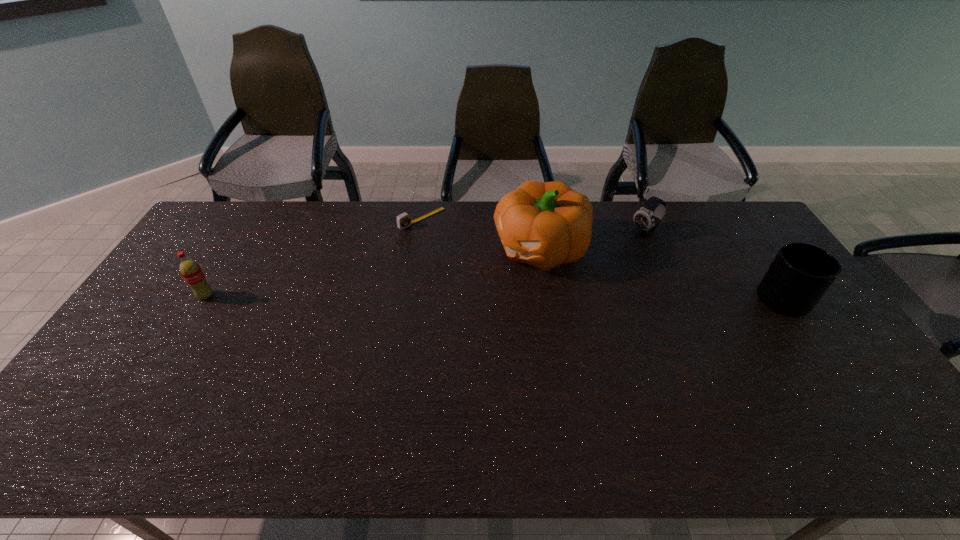
The width and height of the screenshot is (960, 540). I want to click on watch present at the far edge, so click(647, 219).

Locate an element on the screen. object that is at the left edge is located at coordinates (190, 270).

The image size is (960, 540). I want to click on object present at the right edge, so click(800, 274).

Image resolution: width=960 pixels, height=540 pixels. Find the location of `blank space at the far edge`. blank space at the far edge is located at coordinates (414, 204).

Find the location of a particular element. This screenshot has height=540, width=960. vacant space at the near edge of the desktop is located at coordinates tap(276, 412).

You are a GUI agent. You are given a task and a screenshot of the screen. Output one action in this format:
    pyautogui.click(x=<x>, y=<y>)
    Task: Click on the vacant area at the left edge
    
    Given the screenshot: What is the action you would take?
    pyautogui.click(x=171, y=286)

The width and height of the screenshot is (960, 540). What are the coordinates of `free spot at the right edge of the desktop` in the screenshot? It's located at 736,248.

Locate an element on the screen. The width and height of the screenshot is (960, 540). vacant region at the far left corner of the desktop is located at coordinates (200, 238).

At what (x,y) coordinates should I click in order to perform the action: click on free space at the far right corner. Please return your answer as a coordinate pair (x, y). The width and height of the screenshot is (960, 540). Looking at the image, I should click on (706, 215).

You are a GUI agent. You are given a task and a screenshot of the screen. Output one action in this format:
    pyautogui.click(x=<x>, y=<y>)
    Task: Click on the vacant space in between the rightmost object and the tallest object
    This screenshot has height=540, width=960.
    Given the screenshot: What is the action you would take?
    pyautogui.click(x=666, y=274)